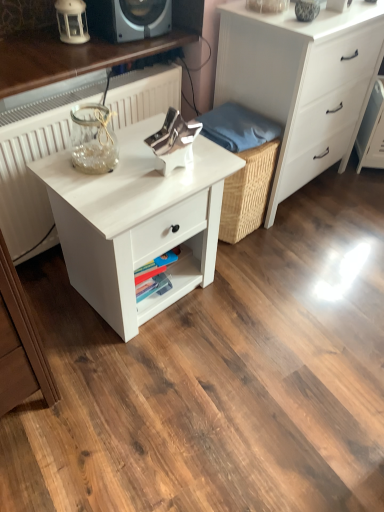
Question: Considering the relative positions of white matte nightstand at center and blue fabric at center in the image provided, is white matte nightstand at center to the left or to the right of blue fabric at center?

Choices:
 (A) left
 (B) right

Answer: (A)

Question: Is white matte nightstand at center wider or thinner than blue fabric at center?

Choices:
 (A) wide
 (B) thin

Answer: (A)

Question: Which object is positioned farthest from the blue fabric at center?

Choices:
 (A) white matte chest of drawers at center
 (B) white matte nightstand at center
 (C) white matte lantern at upper left
 (D) white textured radiator at left

Answer: (C)

Question: Considering the real-world distances, which object is farthest from the white matte lantern at upper left?

Choices:
 (A) white textured radiator at left
 (B) white matte nightstand at center
 (C) blue fabric at center
 (D) white matte chest of drawers at center

Answer: (D)